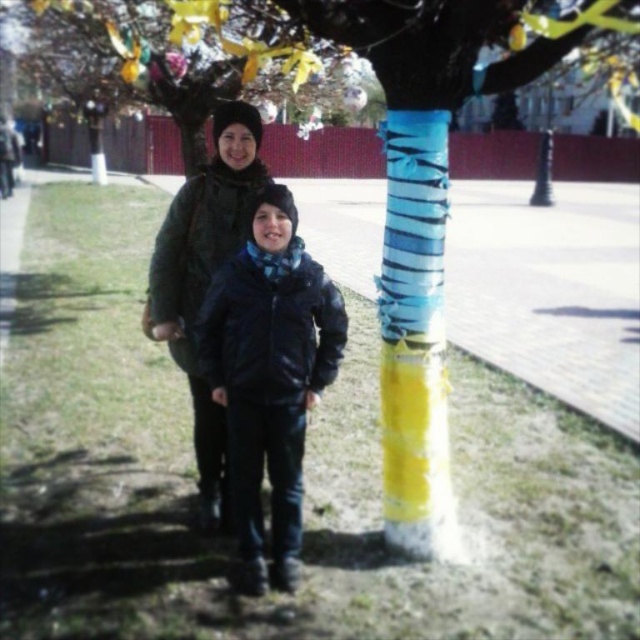
Question: Is glossy black jacket at center smaller than matte black jacket at center?

Choices:
 (A) yes
 (B) no

Answer: (A)

Question: Among these objects, which one is nearest to the camera?

Choices:
 (A) glossy black jacket at center
 (B) decorative painted tree trunk at center

Answer: (A)

Question: Is decorative painted tree trunk at center in front of glossy black jacket at center?

Choices:
 (A) yes
 (B) no

Answer: (B)

Question: Can you confirm if glossy black jacket at center is positioned above matte black jacket at center?

Choices:
 (A) yes
 (B) no

Answer: (B)

Question: Which of the following is the closest to the observer?

Choices:
 (A) matte black jacket at center
 (B) glossy black jacket at center
 (C) decorative painted tree trunk at center

Answer: (B)

Question: Which point is farther to the camera?

Choices:
 (A) glossy black jacket at center
 (B) matte black jacket at center

Answer: (B)